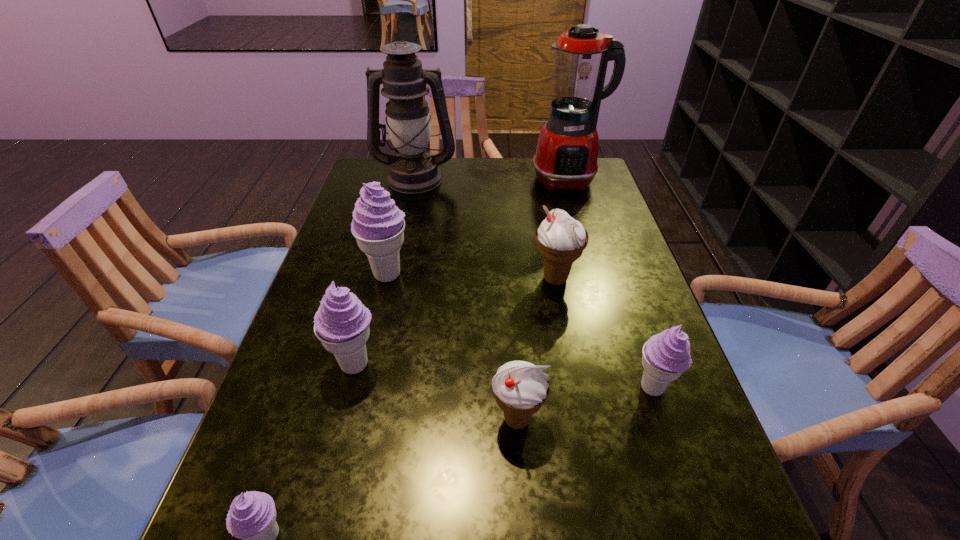
Find the location of a particular element. The image size is (960, 540). vacant point located between the blue oil lamp and the food processor is located at coordinates pos(492,179).

Find the location of `free point between the biggest purple icecream and the rightmost purple icecream`. free point between the biggest purple icecream and the rightmost purple icecream is located at coordinates (519, 331).

I want to click on empty space that is in between the bigger white icecream and the sixth shortest object, so (x=471, y=276).

Where is `free spot between the bigger white icecream and the nearer white icecream`? The image size is (960, 540). free spot between the bigger white icecream and the nearer white icecream is located at coordinates tap(536, 349).

Where is `empty space between the nearer white icecream and the sixth shortest object`? The height and width of the screenshot is (540, 960). empty space between the nearer white icecream and the sixth shortest object is located at coordinates (452, 347).

Identify which object is the nearest to the rightmost purple icecream. Please provide its 2D coordinates. Your answer should be formatted as a tuple, i.e. [(x, y)], where the tuple contains the x and y coordinates of a point satisfying the conditions above.

[(520, 388)]

Point out which object is positioned as the third nearest to the third icecream from right to left. Please provide its 2D coordinates. Your answer should be formatted as a tuple, i.e. [(x, y)], where the tuple contains the x and y coordinates of a point satisfying the conditions above.

[(561, 239)]

Identify which icecream is the fifth closest to the farther white icecream. Please provide its 2D coordinates. Your answer should be formatted as a tuple, i.e. [(x, y)], where the tuple contains the x and y coordinates of a point satisfying the conditions above.

[(252, 516)]

Locate an element on the screen. icecream that can be found as the closest to the nearest object is located at coordinates (342, 322).

Locate an element on the screen. purple icecream that is the third closest to the biggest purple icecream is located at coordinates (666, 356).